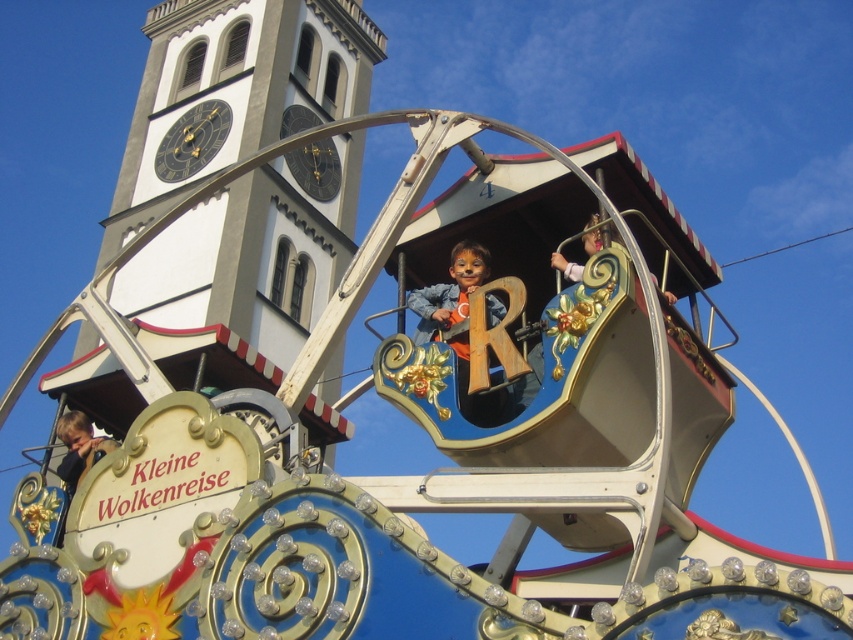
You are a visitor at the fairground and want to take a photo of both the white painted stone tower at upper center and the light brown wooden head at lower left in the same frame. Based on their sizes, which object should you focus on first to ensure both are visible in your photo?

The white painted stone tower at upper center is taller than the light brown wooden head at lower left. To capture both in the same frame, focus on positioning the camera so that the taller white painted stone tower at upper center is centered, allowing the shorter light brown wooden head at lower left to be included in the lower portion of the photo.

You are a visitor at the fairground and want to take a photo of the white painted stone tower at upper center and the light brown wooden head at lower left. Which object should you focus on first to ensure both are in the frame?

You should focus on the light brown wooden head at lower left first because the white painted stone tower at upper center is closer to you, so adjusting the camera to include both would require ensuring the tower is framed first before including the head which is further back.

You are standing at the base of the white painted stone tower at upper center and want to reach the Kleine Wolkenreise ride. Which direction should you head to from the tower to reach the ride?

The Kleine Wolkenreise ride is located in the foreground relative to the white painted stone tower at upper center. Since the tower is at upper center, heading downward or towards the lower part of the scene would lead you to the ride.